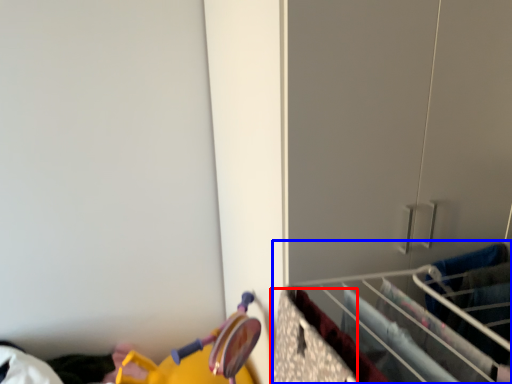
Question: Which object is further to the camera taking this photo, drawer (highlighted by a red box) or closet (highlighted by a blue box)?

Choices:
 (A) drawer
 (B) closet

Answer: (B)